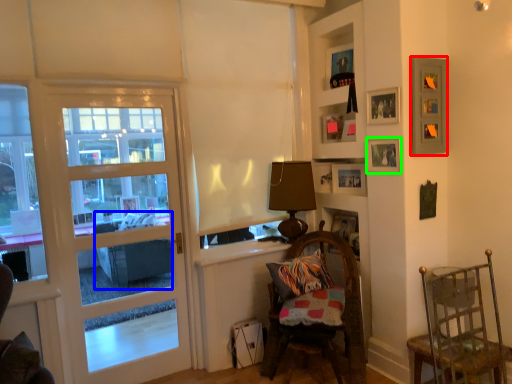
Question: Which is farther away from picture frame (highlighted by a red box)? studio couch (highlighted by a blue box) or picture frame (highlighted by a green box)?

Choices:
 (A) studio couch
 (B) picture frame

Answer: (A)